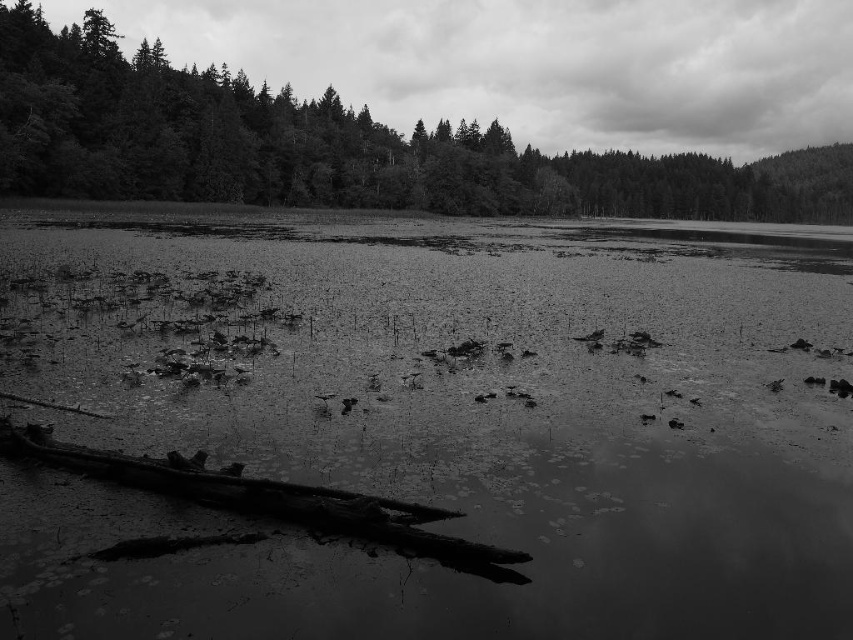
You are a photographer standing at the edge of the water. You want to capture a photo where the smooth bark tree at center is clearly visible behind the translucent murky water at center. Is this possible given their positions?

The translucent murky water at center is in front of the smooth bark tree at center, so the tree may appear blurred or less distinct in the photo due to the water being between the camera and the tree.

You are a surveyor measuring the distance between two objects in the scene. You have a measuring tape that can extend up to 100 meters. Can you measure the distance between the translucent murky water at center and the smooth bark tree at center with your current equipment?

The distance between the translucent murky water at center and the smooth bark tree at center is 104.96 meters, which exceeds the 100 meter limit of your measuring tape. You will need a longer measuring tape or alternative method to accurately measure this distance.

You are a photographer trying to capture the reflection of the smooth bark tree at center in the translucent murky water at center. Will you be able to see the reflection clearly?

The translucent murky water at center is below the smooth bark tree at center, but since the water is murky, the reflection of the smooth bark tree at center may not be clear.